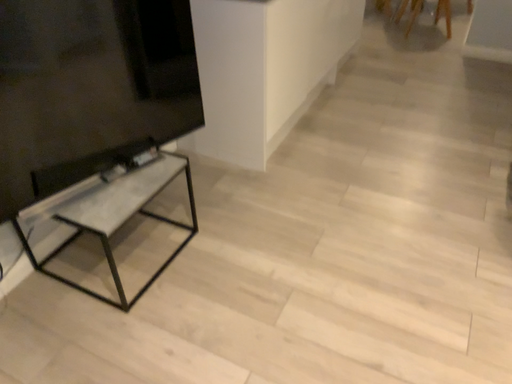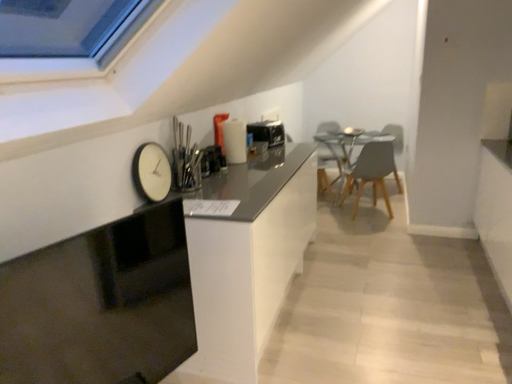
Question: Which way did the camera rotate in the video?

Choices:
 (A) rotated downward
 (B) rotated upward

Answer: (B)